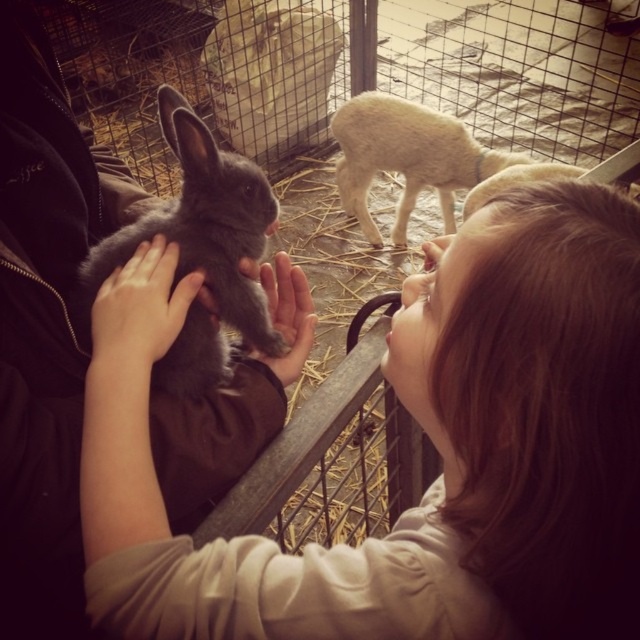
You are a zookeeper who needs to place two rabbits, the smooth gray rabbit at center and the matte gray rabbit at center, into their respective habitats. Based on their positions in the image, which rabbit should be placed lower in the enclosure?

The smooth gray rabbit at center should be placed lower in the enclosure because it is positioned below the matte gray rabbit at center in the image.

You are a parent trying to choose between two rabbits for your child to hold. The gray soft fur rabbit at center and the matte gray rabbit at center are both available. Based on their positions in the image, which rabbit is closer to the child?

The gray soft fur rabbit at center is closer to the child because it is positioned to the left of the matte gray rabbit at center, and since the child is leaning over the fence, the left side would be nearer to them.